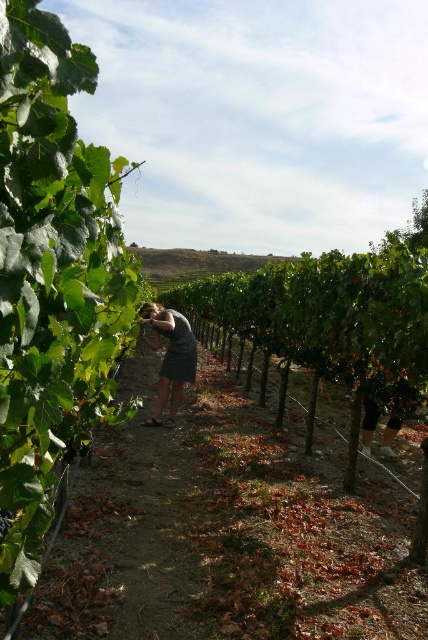
You are standing at the center of the vineyard and notice a dark gray dress at center. Where exactly is the dark gray dress located in relation to your position?

The dark gray dress at center is located at point 0.559 on the x axis and 0.400 on the y axis relative to the image frame.